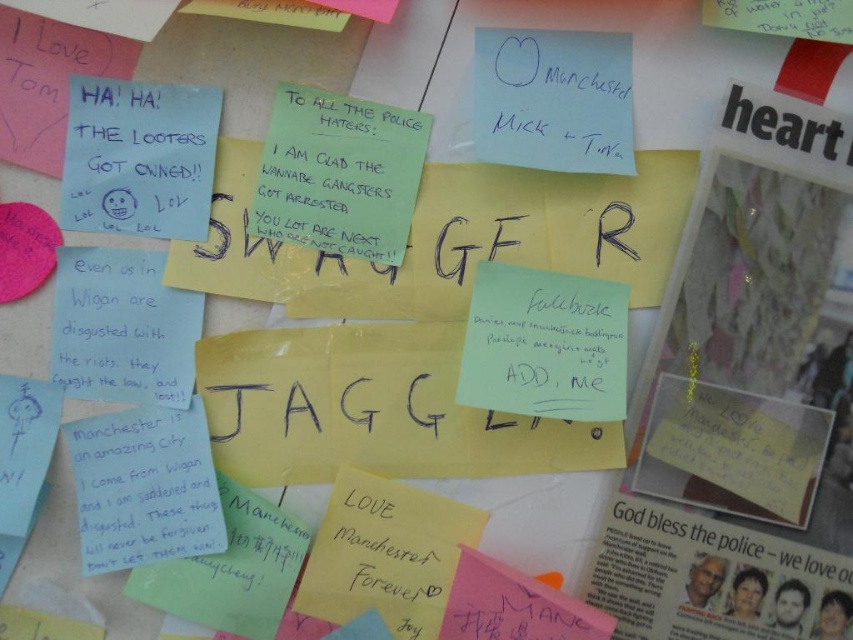
Does point (714, 364) come behind point (357, 164)?

That is False.

Is yellow paper note at upper right taller than green paper note at center?

Correct, yellow paper note at upper right is much taller as green paper note at center.

The height and width of the screenshot is (640, 853). Identify the location of yellow paper note at upper right. (741, 397).